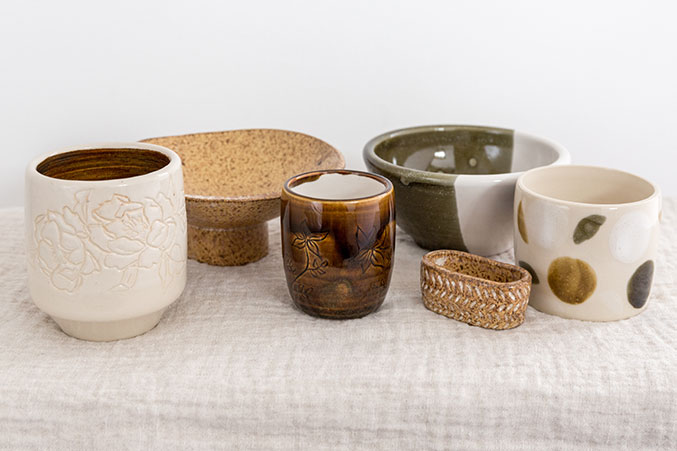
Image resolution: width=677 pixels, height=451 pixels. What are the coordinates of `basket` in the screenshot? It's located at (466, 280).